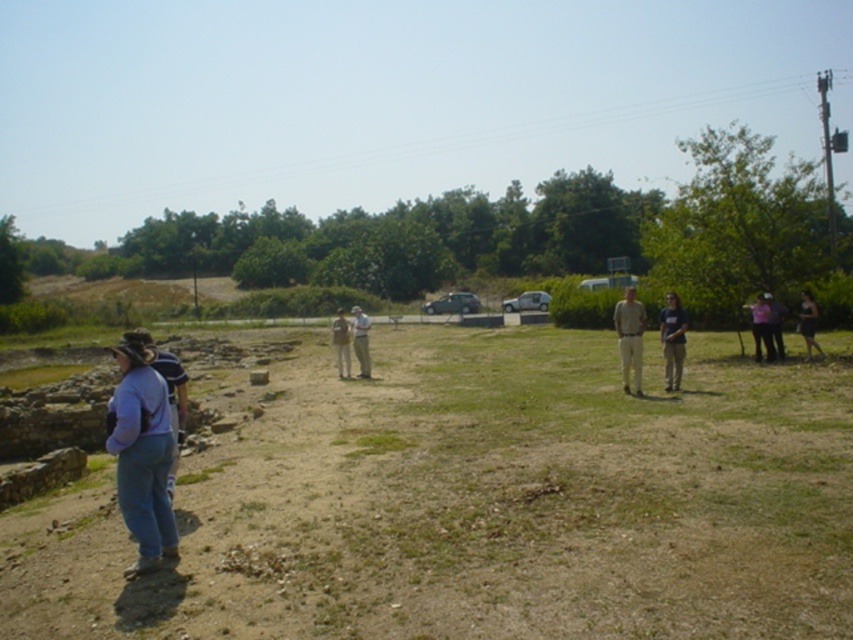
Can you confirm if blue denim jeans at lower left is bigger than denim pants at center?

Incorrect, blue denim jeans at lower left is not larger than denim pants at center.

Who is taller, blue denim jeans at lower left or denim pants at center?

With more height is denim pants at center.

The height and width of the screenshot is (640, 853). What do you see at coordinates (141, 454) in the screenshot?
I see `blue denim jeans at lower left` at bounding box center [141, 454].

The height and width of the screenshot is (640, 853). Identify the location of blue denim jeans at lower left. (141, 454).

Does point (160, 557) lie in front of point (810, 342)?

Yes, it is.

Describe the element at coordinates (141, 454) in the screenshot. I see `blue denim jeans at lower left` at that location.

The height and width of the screenshot is (640, 853). In order to click on blue denim jeans at lower left in this screenshot , I will do `click(141, 454)`.

Can you confirm if blue denim jeans at lower left is smaller than light brown leather jacket at center?

Yes.

Is point (151, 566) closer to viewer compared to point (349, 364)?

Yes.

At what (x,y) coordinates should I click in order to perform the action: click on blue denim jeans at lower left. Please return your answer as a coordinate pair (x, y). The height and width of the screenshot is (640, 853). Looking at the image, I should click on (141, 454).